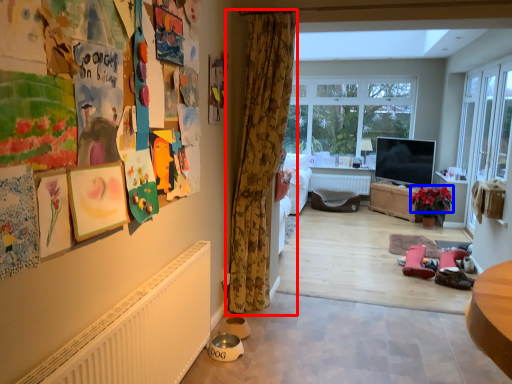
Question: Which object appears closest to the camera in this image, curtain (highlighted by a red box) or flower (highlighted by a blue box)?

Choices:
 (A) curtain
 (B) flower

Answer: (A)